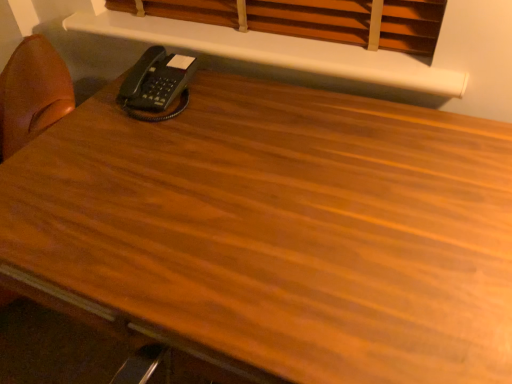
Identify the location of vacant region to the left of black plastic phone at upper left. click(x=88, y=109).